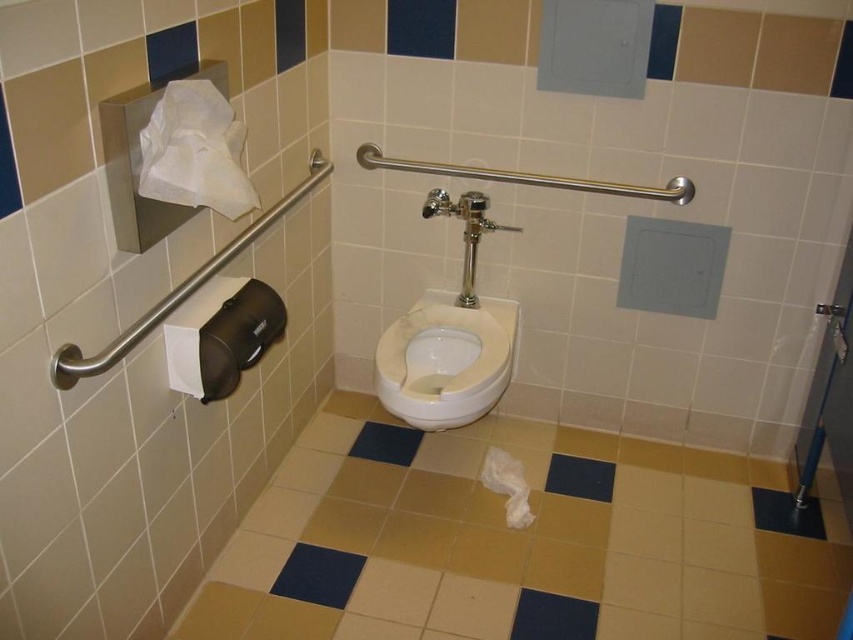
You are standing in the restroom and want to reach both points. Which point, point (x=230, y=168) or point (x=193, y=381), is closer to you?

Point (x=230, y=168) is closer to you than point (x=193, y=381).

You are a maintenance worker checking the restroom. You need to ensure that the white glossy toilet bowl at center is at least 80 centimeters away from the white paper towel at upper left. Based on the image, is this requirement met?

The distance between the white glossy toilet bowl at center and the white paper towel at upper left is 82.92 centimeters, which is greater than the required 80 centimeters. Therefore, the requirement is met.

You are a maintenance worker checking the restroom. You need to determine if the white fluffy toilet paper at lower center is placed in a position that could be easily reached by someone sitting on the white glossy toilet bowl at center. Based on their positions, can you confirm if the toilet paper is within reach?

The white glossy toilet bowl at center is above the white fluffy toilet paper at lower center, so the toilet paper is placed lower and closer to the floor. Someone sitting on the toilet bowl would likely need to reach downward to access it, which might be a bit inconvenient but still reachable depending on arm length.